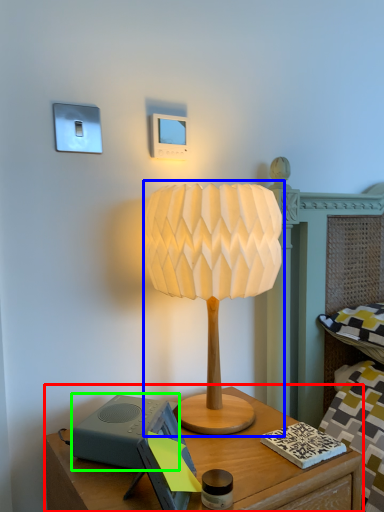
Question: Which object is the closest to the nightstand (highlighted by a red box)? Choose among these: lamp (highlighted by a blue box) or speaker (highlighted by a green box).

Choices:
 (A) lamp
 (B) speaker

Answer: (B)